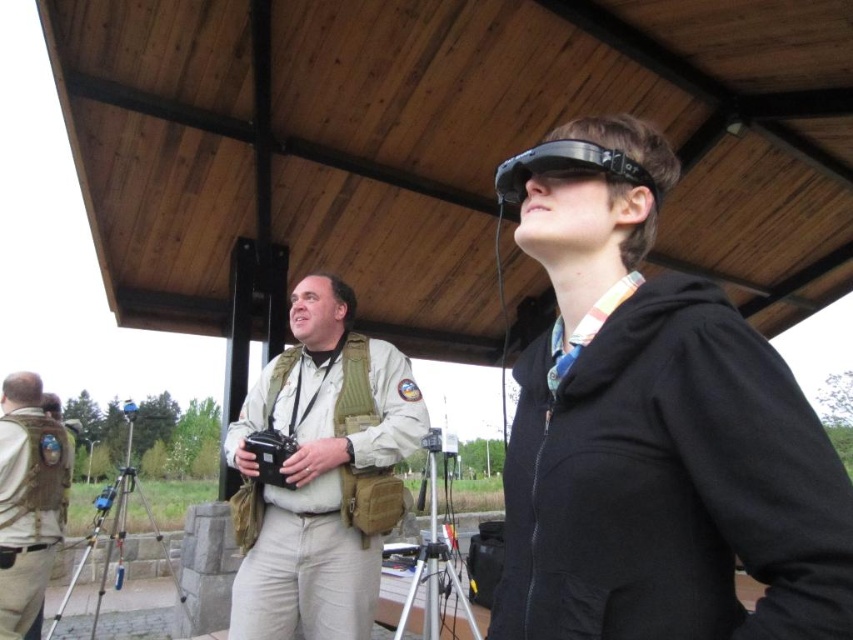
You are a photographer trying to adjust the camera on the silver metallic tripod at lower center. There is a camouflage fabric vest at center in the way. Can you move the vest to access the tripod?

The camouflage fabric vest at center is further to the viewer than the silver metallic tripod at lower center, so you can move the vest to access the tripod since it is closer to you.

You are setting up a photography equipment in the park and need to place both the camouflage fabric vest at center and the silver metallic tripod at lower center. Since the tripod is larger, where should you position the smaller item to avoid blocking the camera view?

Result: The camouflage fabric vest at center is smaller than the silver metallic tripod at lower center, so you should place the camouflage fabric vest at center on top of or beside the tripod to keep it out of the camera view.

Based on the photo, you are a photographer trying to set up a camera. You have a tan fabric vest at center and a blue plastic tripod at lower left. If the tripod needs to be positioned exactly 8 feet away from the vest, will it fit within the required distance?

The tan fabric vest at center and blue plastic tripod at lower left are 8.42 feet apart from each other. Since 8.42 feet is slightly more than 8 feet, the tripod is just beyond the required distance. You may need to move it closer by about 0.42 feet to meet the 8 feet requirement.